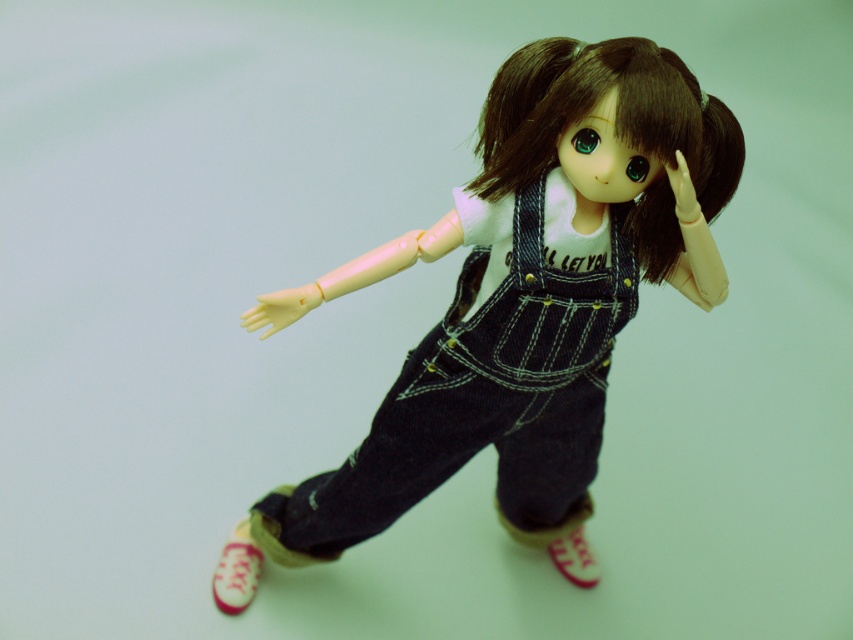
Question: Is denim overalls at center in front of yellow matte hand at lower left?

Choices:
 (A) yes
 (B) no

Answer: (A)

Question: Which object is the farthest from the matte plastic hand at upper right?

Choices:
 (A) denim overalls at center
 (B) brownsmoothhair at center
 (C) yellow matte hand at lower left

Answer: (C)

Question: Which object is closer to the camera taking this photo?

Choices:
 (A) matte plastic hand at upper right
 (B) pink fabric shoe at lower left
 (C) brownsmoothhair at center

Answer: (A)

Question: Is denim overalls at center to the left of pink fabric shoe at lower left from the viewer's perspective?

Choices:
 (A) yes
 (B) no

Answer: (B)

Question: In this image, where is pink fabric shoe at lower left located relative to yellow matte hand at lower left?

Choices:
 (A) below
 (B) above

Answer: (A)

Question: Estimate the real-world distances between objects in this image. Which object is farther from the denim overalls at center?

Choices:
 (A) matte pink rubber shoe at lower center
 (B) pink fabric shoe at lower left
 (C) yellow matte hand at lower left
 (D) brownsmoothhair at center

Answer: (B)